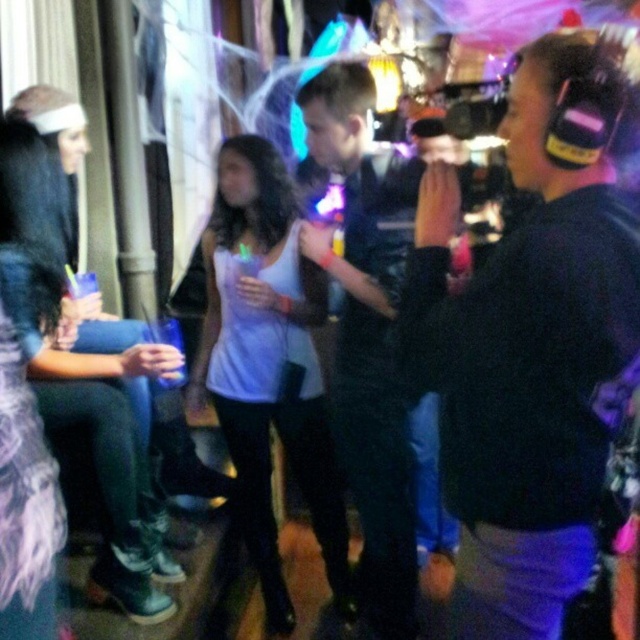
Based on the scene description, what object is located at the coordinates point (268,364)?

The point (268,364) corresponds to the white matte tank top at center.

You are organizing a photo shoot and need to adjust the distance between the white matte tank top at center and the black leather jacket at center to ensure they are exactly 12 inches apart. Currently, they are 11.36 inches apart. Should you move them closer together or farther apart?

The current distance between the white matte tank top at center and the black leather jacket at center is 11.36 inches. To reach the desired 12 inches, you should move them farther apart by 0.64 inches.